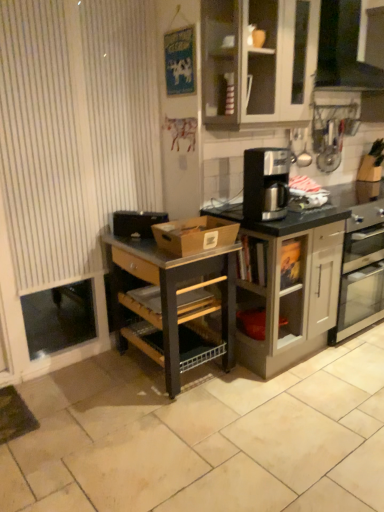
Locate an element on the screen. free space in front of metallic black shelf at center is located at coordinates (166, 424).